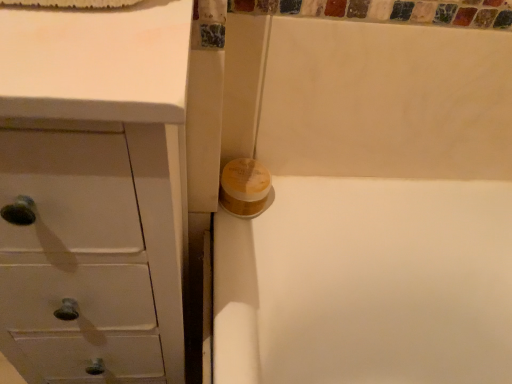
Question: Based on their positions, is yellow matte toilet paper at center located to the left or right of white matte chest of drawers at left?

Choices:
 (A) left
 (B) right

Answer: (B)

Question: Considering their positions, is yellow matte toilet paper at center located in front of or behind white matte chest of drawers at left?

Choices:
 (A) front
 (B) behind

Answer: (B)

Question: Looking at the image, does yellow matte toilet paper at center seem bigger or smaller compared to white matte chest of drawers at left?

Choices:
 (A) small
 (B) big

Answer: (A)

Question: Is white matte chest of drawers at left taller or shorter than yellow matte toilet paper at center?

Choices:
 (A) short
 (B) tall

Answer: (B)

Question: Looking at the image, does white matte chest of drawers at left seem bigger or smaller compared to yellow matte toilet paper at center?

Choices:
 (A) big
 (B) small

Answer: (A)

Question: In the image, is white matte chest of drawers at left positioned in front of or behind yellow matte toilet paper at center?

Choices:
 (A) behind
 (B) front

Answer: (B)

Question: Is white matte chest of drawers at left to the left or to the right of yellow matte toilet paper at center in the image?

Choices:
 (A) right
 (B) left

Answer: (B)